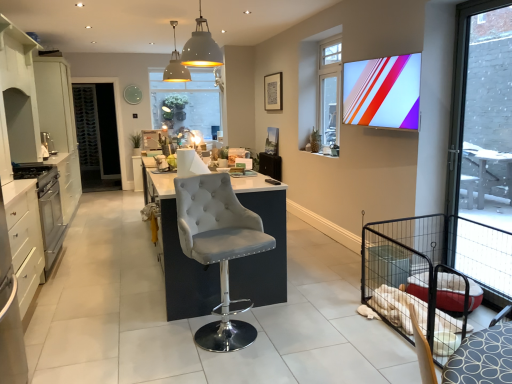
At what (x,y) coordinates should I click in order to perform the action: click on vacant space situated on the left part of velvet grey bar stool at center. Please return your answer as a coordinate pair (x, y). The height and width of the screenshot is (384, 512). Looking at the image, I should click on [x=144, y=339].